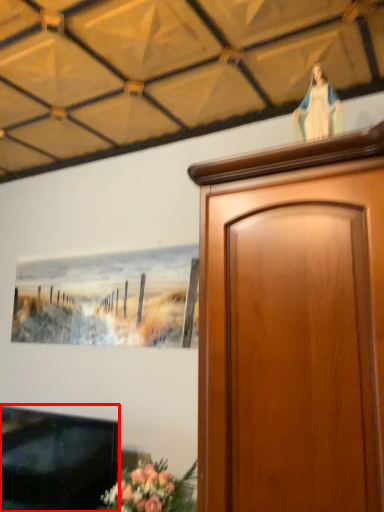
Question: Considering the relative positions of television (annotated by the red box) and woman in the image provided, where is television (annotated by the red box) located with respect to the staircase?

Choices:
 (A) left
 (B) right

Answer: (A)